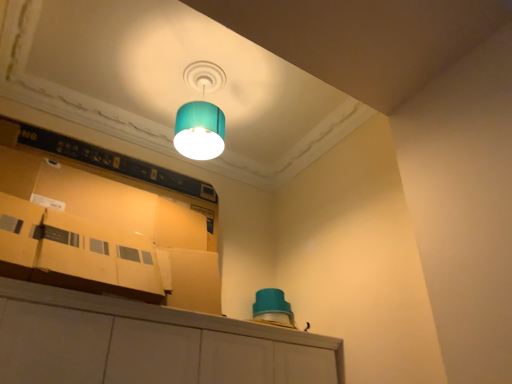
What are the coordinates of `teal fabric lampshade at upper center` in the screenshot? It's located at (201, 115).

What do you see at coordinates (201, 115) in the screenshot? I see `teal fabric lampshade at upper center` at bounding box center [201, 115].

In order to click on teal fabric lampshade at upper center in this screenshot , I will do `click(201, 115)`.